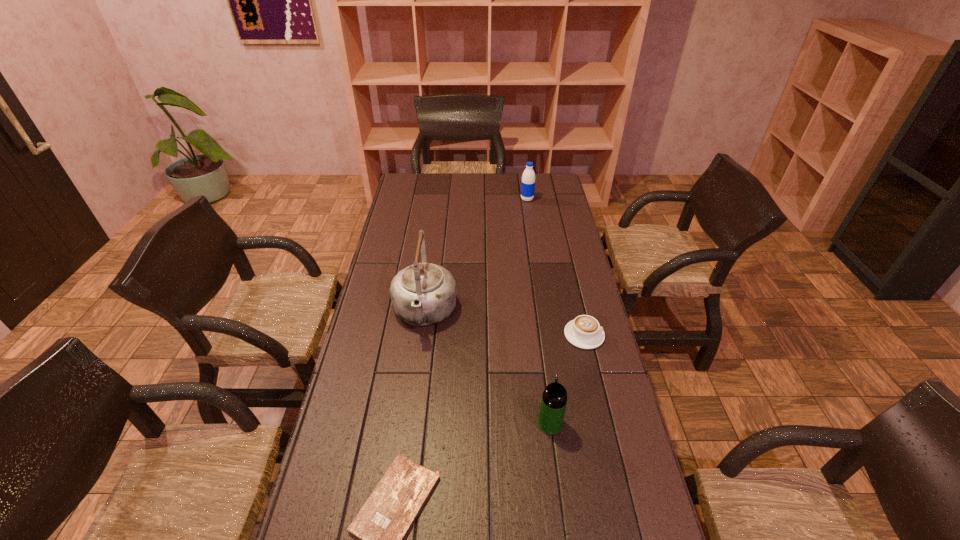
Locate an element on the screen. object located in the far edge section of the desktop is located at coordinates point(528,178).

At what (x,y) coordinates should I click in order to perform the action: click on object that is at the left edge. Please return your answer as a coordinate pair (x, y). Looking at the image, I should click on point(423,294).

The height and width of the screenshot is (540, 960). What are the coordinates of `water bottle positioned at the right edge` in the screenshot? It's located at (528, 178).

You are a GUI agent. You are given a task and a screenshot of the screen. Output one action in this format:
    pyautogui.click(x=<x>, y=<y>)
    Task: Click on the cappuccino present at the right edge
    This screenshot has width=960, height=540.
    Given the screenshot: What is the action you would take?
    pyautogui.click(x=585, y=332)

You are a GUI agent. You are given a task and a screenshot of the screen. Output one action in this format:
    pyautogui.click(x=<x>, y=<y>)
    Task: Click on the object at the far right corner
    This screenshot has height=540, width=960.
    Given the screenshot: What is the action you would take?
    pyautogui.click(x=528, y=178)

Locate an element on the screen. The height and width of the screenshot is (540, 960). blank space at the far edge of the desktop is located at coordinates (445, 185).

Locate an element on the screen. The width and height of the screenshot is (960, 540). vacant space at the left edge of the desktop is located at coordinates (388, 267).

This screenshot has height=540, width=960. I want to click on vacant space at the right edge of the desktop, so 592,357.

Identify the location of vacant space at the far left corner of the desktop. The image size is (960, 540). (413, 183).

At what (x,y) coordinates should I click in order to perform the action: click on blank space at the far right corner of the desktop. Please return your answer as a coordinate pair (x, y). This screenshot has height=540, width=960. Looking at the image, I should click on (561, 188).